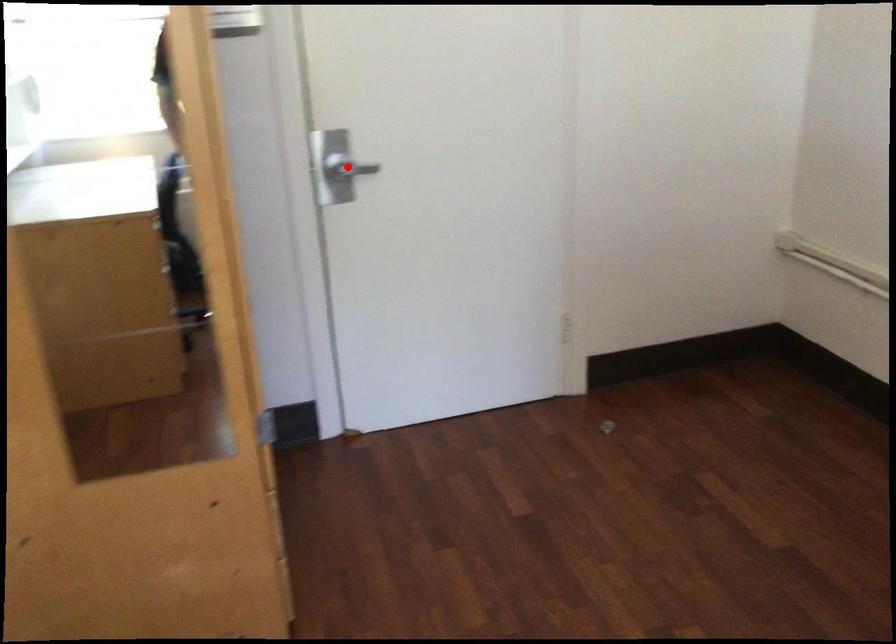
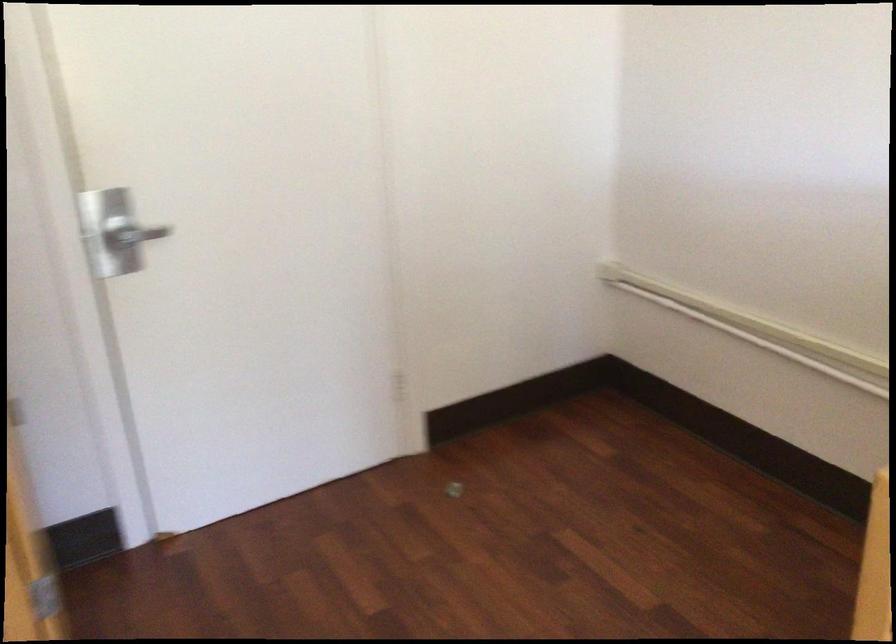
Question: I am providing you with two images of the same scene from different viewpoints. A red point is shown in image1. For the corresponding object point in image2, is it positioned nearer or farther from the camera?

Choices:
 (A) Nearer
 (B) Farther

Answer: (A)